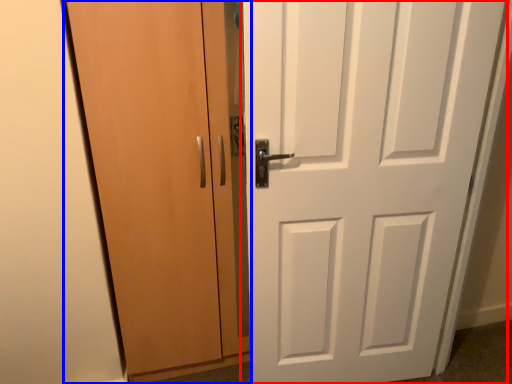
Question: Which of the following is the closest to the observer, door (highlighted by a red box) or door (highlighted by a blue box)?

Choices:
 (A) door
 (B) door

Answer: (A)